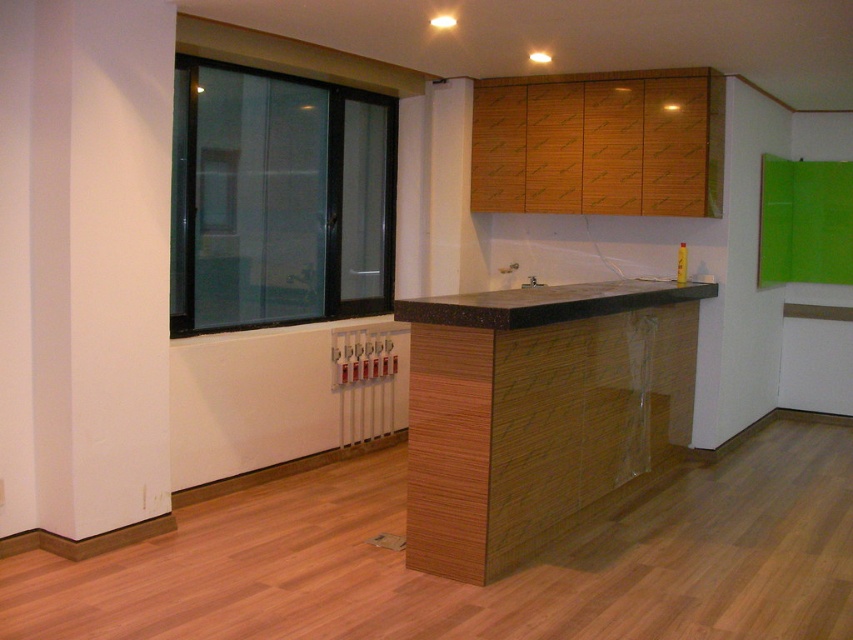
Who is positioned more to the right, black glass window at left or black marble countertop at center?

Positioned to the right is black marble countertop at center.

Who is more forward, (225, 140) or (540, 321)?

Point (540, 321) is more forward.

In order to click on black glass window at left in this screenshot , I will do `click(277, 198)`.